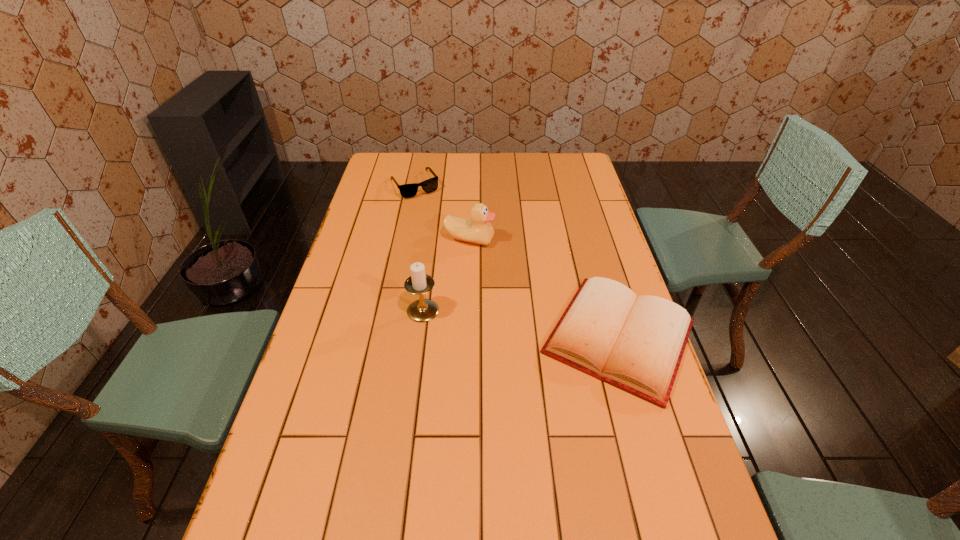
At what (x,y) coordinates should I click in order to perform the action: click on free space on the desktop that is between the candle holder and the rightmost object and is positioned on the front-facing side of the second shortest object. Please return your answer as a coordinate pair (x, y). Looking at the image, I should click on (510, 322).

The image size is (960, 540). I want to click on free space on the desktop that is between the tallest object and the shortest object and is positioned at the beak of the duck, so pyautogui.click(x=537, y=326).